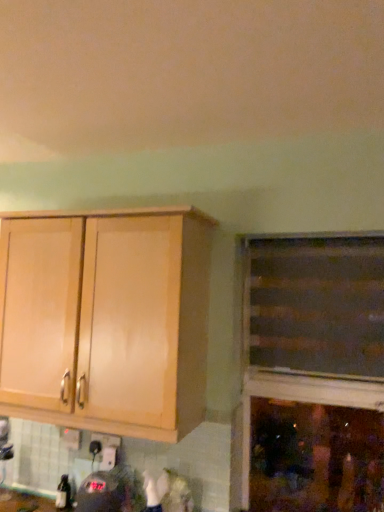
Question: Is the position of light wood cabinet at left, placed as the 1th cabinetry when sorted from left to right, less distant than that of white plastic electric outlet at lower center?

Choices:
 (A) no
 (B) yes

Answer: (B)

Question: Considering the relative sizes of light wood cabinet at left, placed as the 1th cabinetry when sorted from left to right, and white plastic electric outlet at lower center in the image provided, is light wood cabinet at left, placed as the 1th cabinetry when sorted from left to right, smaller than white plastic electric outlet at lower center?

Choices:
 (A) yes
 (B) no

Answer: (B)

Question: Can you confirm if light wood cabinet at left, which ranks as the 2th cabinetry in right-to-left order, is thinner than white plastic electric outlet at lower center?

Choices:
 (A) no
 (B) yes

Answer: (A)

Question: Does light wood cabinet at left, which ranks as the 2th cabinetry in right-to-left order, appear on the left side of white plastic electric outlet at lower center?

Choices:
 (A) yes
 (B) no

Answer: (B)

Question: Is light wood cabinet at left, which ranks as the 2th cabinetry in right-to-left order, outside of white plastic electric outlet at lower center?

Choices:
 (A) no
 (B) yes

Answer: (B)

Question: Considering the positions of wooden cabinet at right, acting as the second cabinetry starting from the left, and white plastic electric outlet at lower center in the image, is wooden cabinet at right, acting as the second cabinetry starting from the left, bigger or smaller than white plastic electric outlet at lower center?

Choices:
 (A) small
 (B) big

Answer: (B)

Question: Is wooden cabinet at right, acting as the second cabinetry starting from the left, taller or shorter than white plastic electric outlet at lower center?

Choices:
 (A) tall
 (B) short

Answer: (A)

Question: Is point (311, 289) closer or farther from the camera than point (109, 436)?

Choices:
 (A) farther
 (B) closer

Answer: (B)

Question: Which is correct: wooden cabinet at right, acting as the second cabinetry starting from the left, is inside white plastic electric outlet at lower center, or outside of it?

Choices:
 (A) inside
 (B) outside

Answer: (B)

Question: Considering the positions of white plastic electric outlet at lower center and light wood cabinet at left, which ranks as the 2th cabinetry in right-to-left order, in the image, is white plastic electric outlet at lower center taller or shorter than light wood cabinet at left, which ranks as the 2th cabinetry in right-to-left order,?

Choices:
 (A) tall
 (B) short

Answer: (B)

Question: Looking at their shapes, would you say white plastic electric outlet at lower center is wider or thinner than light wood cabinet at left, placed as the 1th cabinetry when sorted from left to right?

Choices:
 (A) thin
 (B) wide

Answer: (A)

Question: Would you say white plastic electric outlet at lower center is to the left or to the right of light wood cabinet at left, which ranks as the 2th cabinetry in right-to-left order, in the picture?

Choices:
 (A) left
 (B) right

Answer: (A)

Question: Do you think white plastic electric outlet at lower center is within light wood cabinet at left, which ranks as the 2th cabinetry in right-to-left order, or outside of it?

Choices:
 (A) inside
 (B) outside

Answer: (B)

Question: From the image's perspective, relative to light wood cabinet at left, which ranks as the 2th cabinetry in right-to-left order, is wooden cabinet at right, which is the 1th cabinetry from right to left, above or below?

Choices:
 (A) above
 (B) below

Answer: (A)

Question: Is wooden cabinet at right, acting as the second cabinetry starting from the left, situated inside light wood cabinet at left, placed as the 1th cabinetry when sorted from left to right, or outside?

Choices:
 (A) outside
 (B) inside

Answer: (A)